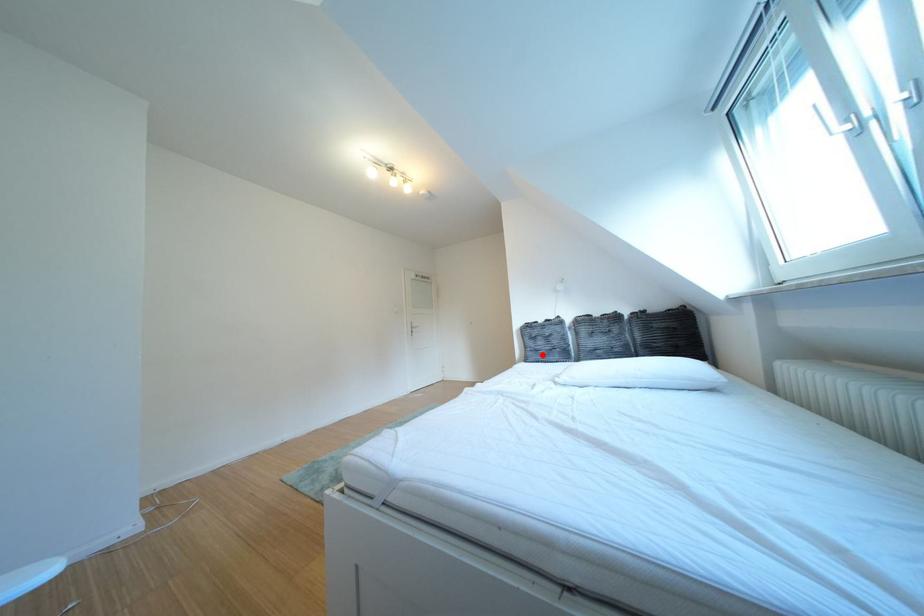
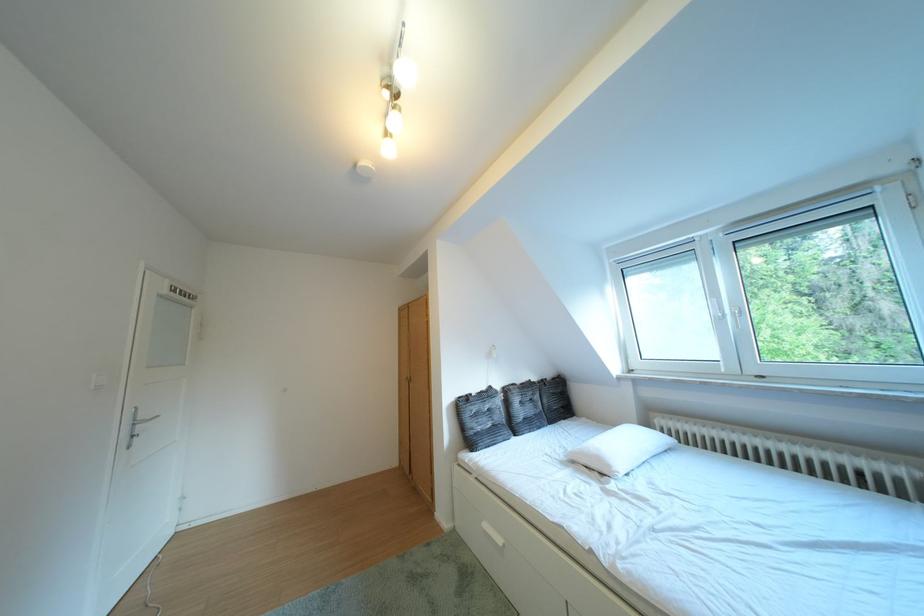
Locate, in the second image, the point that corresponds to the highlighted location in the first image.

(484, 438)